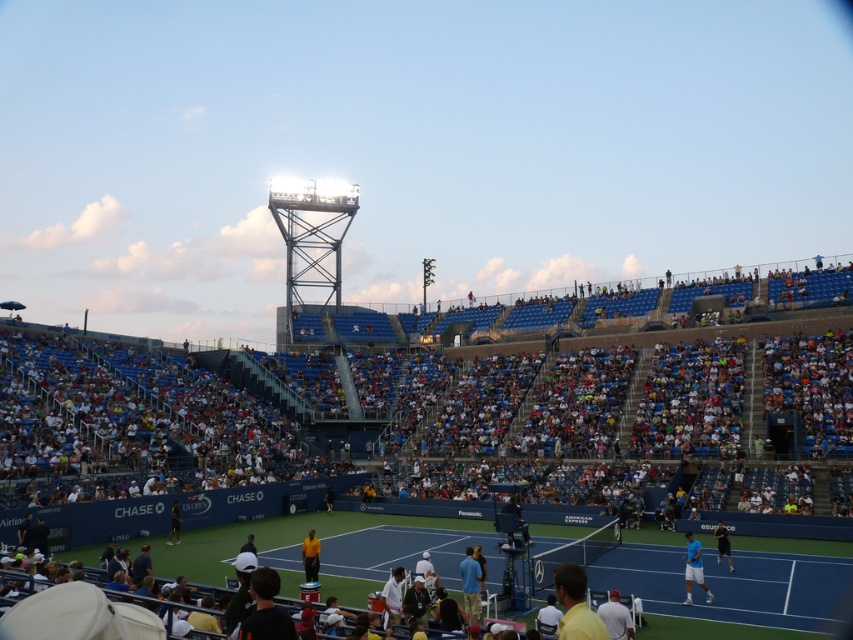
Question: Can you confirm if blue synthetic court at center is thinner than blue fabric shirt at center?

Choices:
 (A) no
 (B) yes

Answer: (A)

Question: Which of the following is the farthest from the observer?

Choices:
 (A) (689, 572)
 (B) (469, 618)
 (C) (589, 497)
 (D) (625, 620)

Answer: (C)

Question: Where is yellow matte shirt at lower center located in relation to dark blue shirt at lower right in the image?

Choices:
 (A) above
 (B) below

Answer: (A)

Question: Among these points, which one is farthest from the camera?

Choices:
 (A) (583, 627)
 (B) (728, 556)
 (C) (312, 550)
 (D) (674, 346)

Answer: (D)

Question: Can you confirm if yellow matte shirt at lower center is positioned above blue fabric tennis player at center?

Choices:
 (A) no
 (B) yes

Answer: (B)

Question: Which point is closer to the camera taking this photo?

Choices:
 (A) (625, 612)
 (B) (469, 605)
 (C) (692, 554)

Answer: (A)